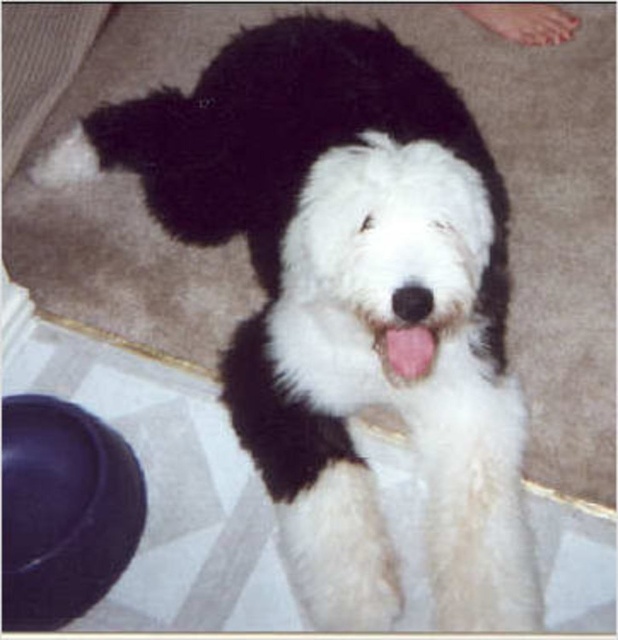
You are a dog owner trying to identify which part of your Old English Sheepdog is bigger between the white fur paw at upper right and the pink flesh at center. Can you tell me which one is bigger?

The white fur paw at upper right has a larger size compared to the pink flesh at center, so the white fur paw at upper right is bigger.

You are a dog owner who wants to place a treat for your Old English Sheepdog. The treat must be placed on the white fur paw at upper right. Given that the coordinates of the treat location are point (x=525, y=20), can you confirm if this point is on the correct paw?

Yes, the point (x=525, y=20) is on the white fur paw at upper right, so placing the treat there would be correct.

You are a dog owner who wants to ensure your pet is comfortable. Looking at the image, which part of the dog is higher up in the picture, the white fur paw at upper right or the pink flesh at center?

The white fur paw at upper right is taller than the pink flesh at center.